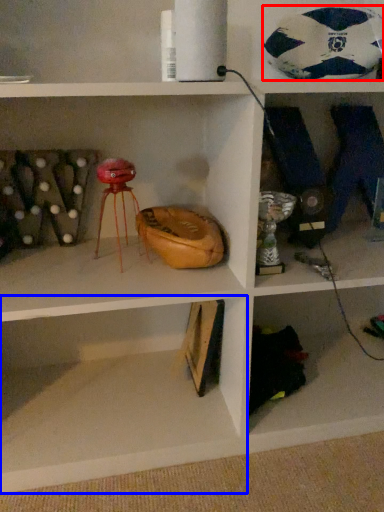
Question: Which object is closer to the camera taking this photo, football (highlighted by a red box) or shelf (highlighted by a blue box)?

Choices:
 (A) football
 (B) shelf

Answer: (B)